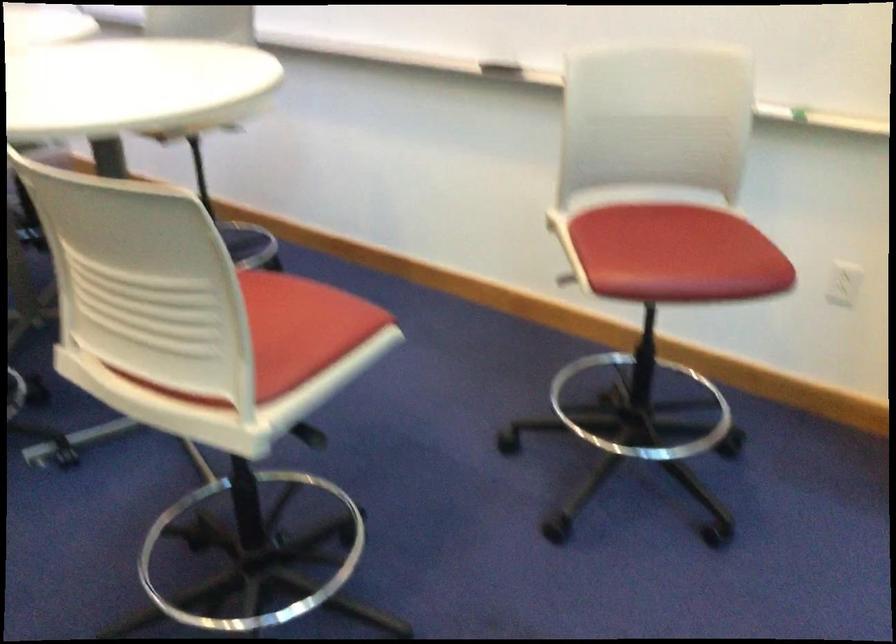
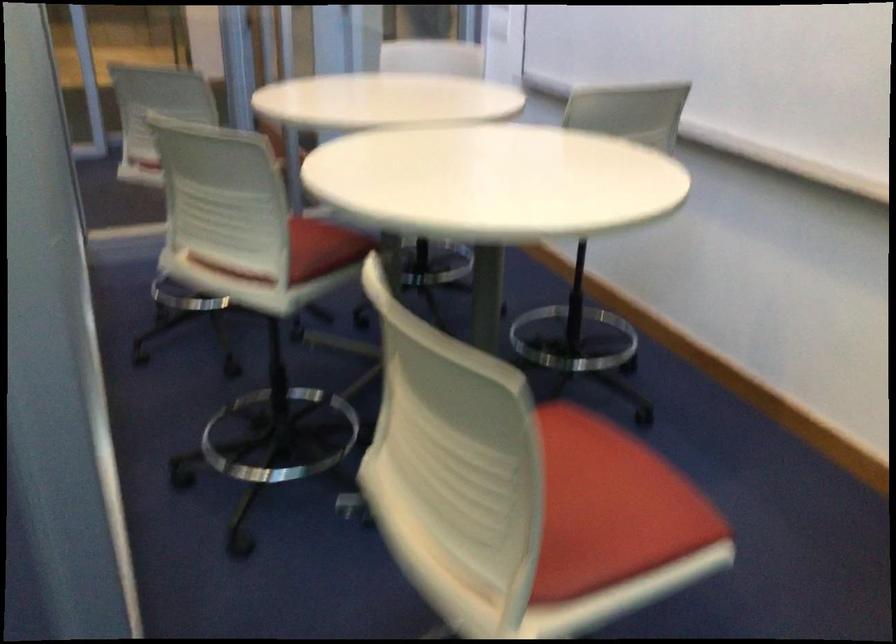
Where in the second image is the point corresponding to point (303, 317) from the first image?

(609, 507)